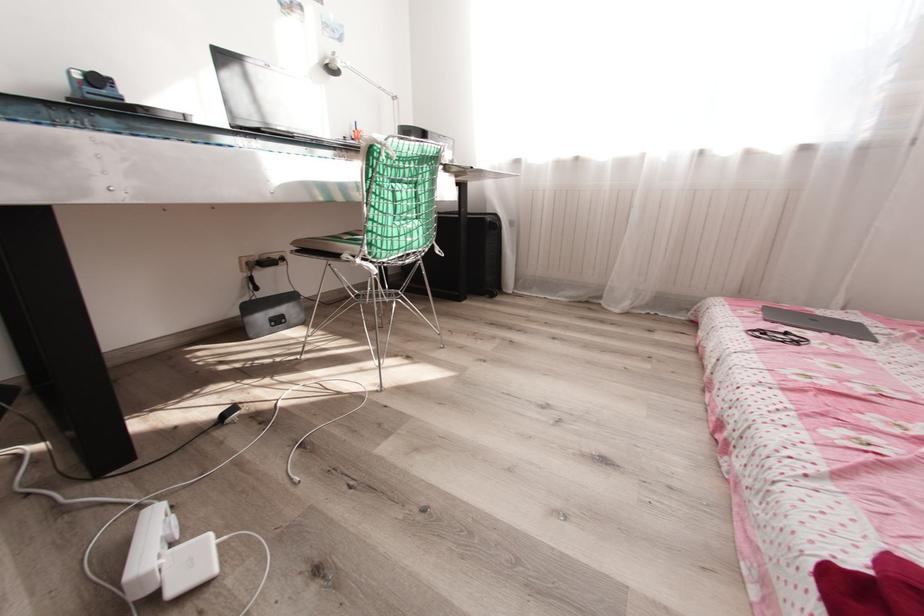
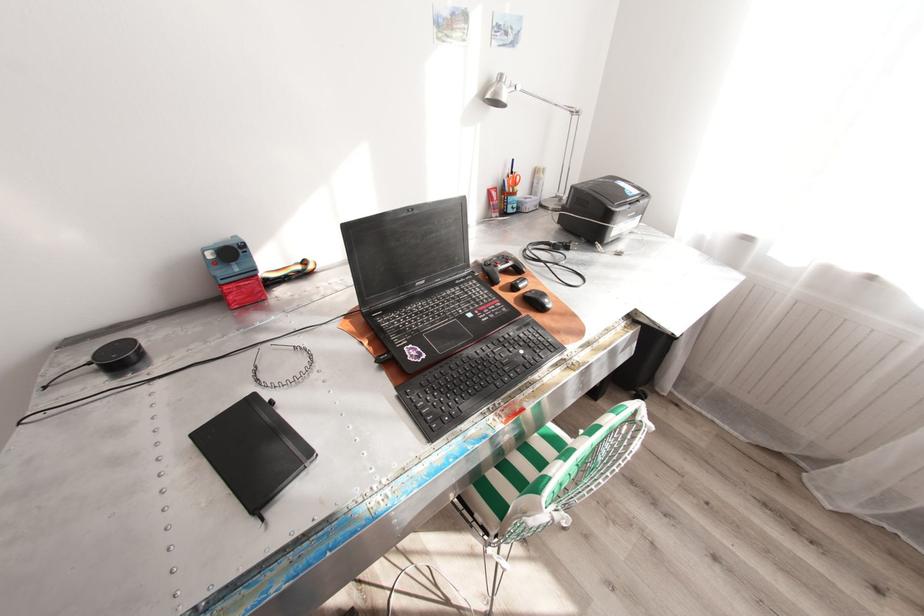
In the second image, find the point that corresponds to the point at 81,75 in the first image.

(215, 254)